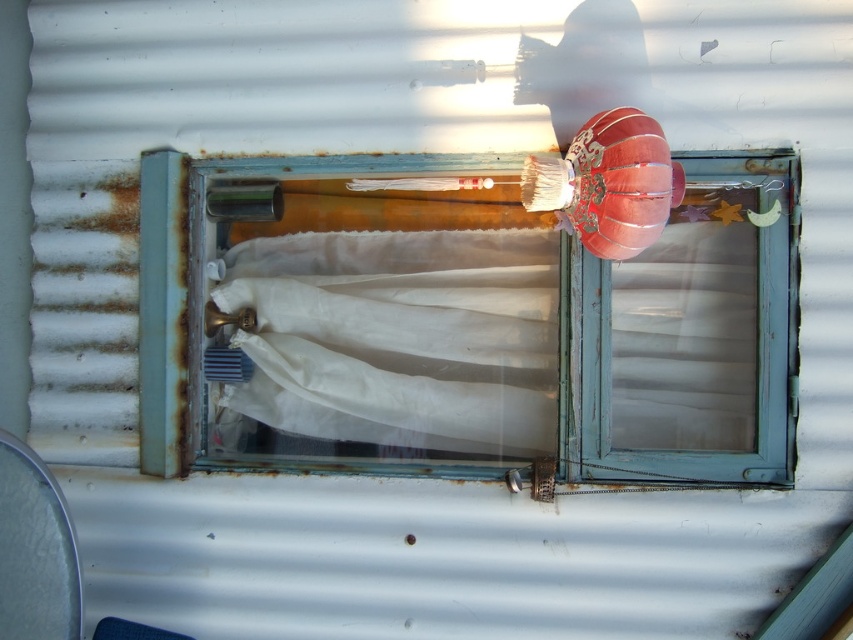
Question: Among these objects, which one is nearest to the camera?

Choices:
 (A) blue painted wood at center
 (B) velvet red paper lantern at upper right

Answer: (B)

Question: Which of the following is the closest to the observer?

Choices:
 (A) (227, 268)
 (B) (625, 221)
 (C) (605, 456)
 (D) (677, 406)

Answer: (B)

Question: Is blue painted wood at center above white sheer cloth at center?

Choices:
 (A) no
 (B) yes

Answer: (B)

Question: Is blue painted wood at center closer to camera compared to velvet red paper lantern at upper right?

Choices:
 (A) no
 (B) yes

Answer: (A)

Question: Based on their relative distances, which object is nearer to the velvet red paper lantern at upper right?

Choices:
 (A) blue painted wood at center
 (B) white sheer curtain at center

Answer: (B)

Question: Can you confirm if white sheer cloth at center is positioned to the left of white sheer curtain at center?

Choices:
 (A) no
 (B) yes

Answer: (B)